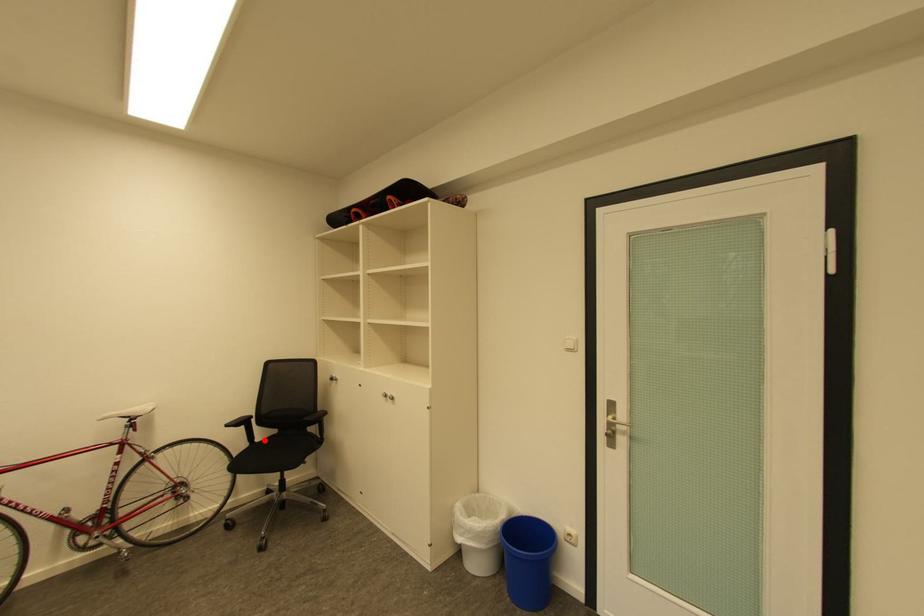
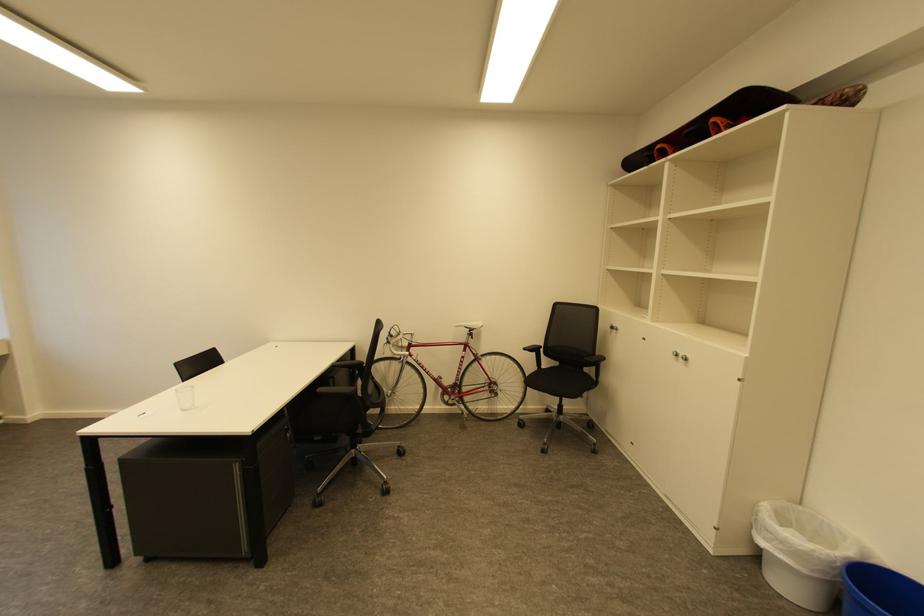
Question: I am providing you with two images of the same scene from different viewpoints. A red point is shown in image1. For the corresponding object point in image2, is it positioned nearer or farther from the camera?

Choices:
 (A) Nearer
 (B) Farther

Answer: (B)